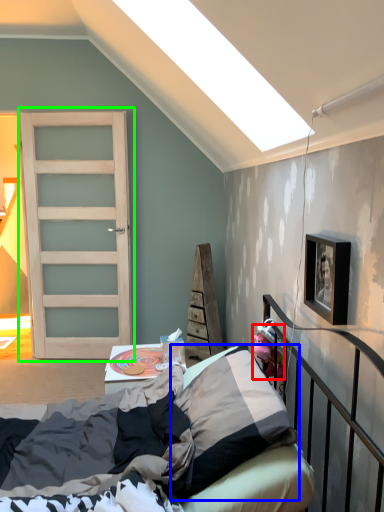
Question: Which object is the farthest from toy (highlighted by a red box)? Choose among these: pillow (highlighted by a blue box) or door (highlighted by a green box).

Choices:
 (A) pillow
 (B) door

Answer: (B)